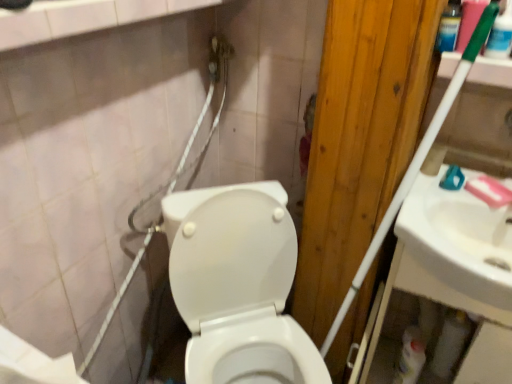
Question: Can you see white matte toilet paper at lower right, which appears as the 2th toilet paper when viewed from the left, touching white glossy toilet at center?

Choices:
 (A) no
 (B) yes

Answer: (A)

Question: Is white matte toilet paper at lower right, the 1th toilet paper positioned from the right, far away from white glossy toilet at center?

Choices:
 (A) yes
 (B) no

Answer: (B)

Question: Is white glossy toilet at center a part of white matte toilet paper at lower right, the 1th toilet paper positioned from the right?

Choices:
 (A) yes
 (B) no

Answer: (B)

Question: Could you tell me if white matte toilet paper at lower right, the second toilet paper in the front-to-back sequence, is facing white glossy toilet at center?

Choices:
 (A) no
 (B) yes

Answer: (A)

Question: Does white matte toilet paper at lower right, which appears as the 2th toilet paper when viewed from the left, have a greater width compared to white glossy toilet at center?

Choices:
 (A) no
 (B) yes

Answer: (A)

Question: Can you confirm if white matte toilet paper at lower right, the 1th toilet paper positioned from the right, is shorter than white glossy toilet at center?

Choices:
 (A) yes
 (B) no

Answer: (A)

Question: Would you say white matte toilet paper at lower right, the 2th toilet paper when ordered from top to bottom, is outside clear plastic bottle at upper right?

Choices:
 (A) no
 (B) yes

Answer: (B)

Question: Does white matte toilet paper at lower right, the 2th toilet paper when ordered from top to bottom, appear on the left side of clear plastic bottle at upper right?

Choices:
 (A) yes
 (B) no

Answer: (B)

Question: Is white matte toilet paper at lower right, the 1th toilet paper positioned from the right, smaller than clear plastic bottle at upper right?

Choices:
 (A) yes
 (B) no

Answer: (B)

Question: From a real-world perspective, is white matte toilet paper at lower right, which is counted as the 1th toilet paper, starting from the back, physically below clear plastic bottle at upper right?

Choices:
 (A) no
 (B) yes

Answer: (B)

Question: Is white matte toilet paper at lower right, which is counted as the 1th toilet paper, starting from the back, beside clear plastic bottle at upper right?

Choices:
 (A) yes
 (B) no

Answer: (B)

Question: Can you confirm if white matte toilet paper at lower right, the 1th toilet paper positioned from the right, is positioned to the right of clear plastic bottle at upper right?

Choices:
 (A) yes
 (B) no

Answer: (A)

Question: Is white glossy bottle at lower right far from white glossy sink at right?

Choices:
 (A) yes
 (B) no

Answer: (B)